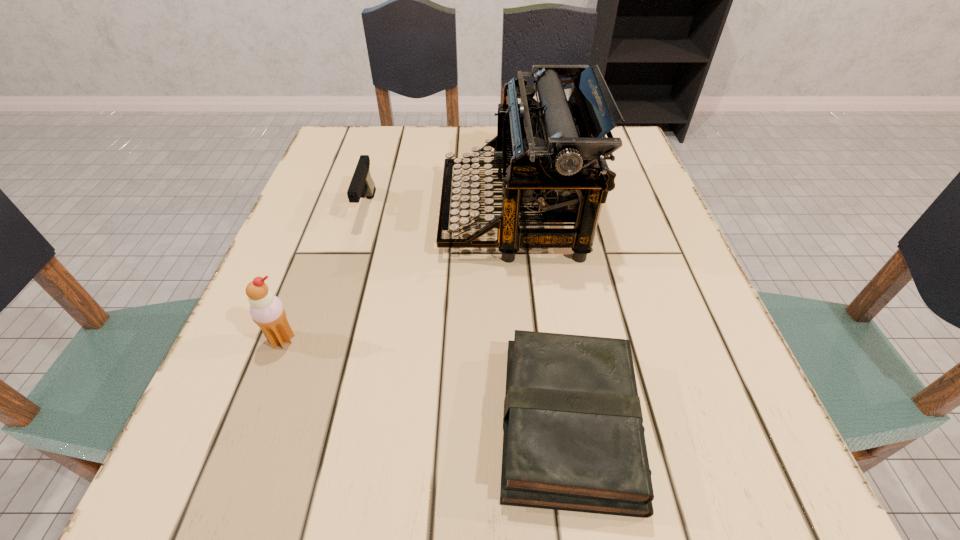
Locate an element on the screen. The width and height of the screenshot is (960, 540). the tallest object is located at coordinates (551, 152).

Find the location of a particular element. Image resolution: width=960 pixels, height=540 pixels. the second tallest object is located at coordinates (267, 311).

Locate an element on the screen. the leftmost object is located at coordinates (267, 311).

Where is `the third tallest object`? the third tallest object is located at coordinates (362, 184).

Locate an element on the screen. the second object from left to right is located at coordinates (362, 184).

Identify the location of the shortest object. (573, 440).

At what (x,y) coordinates should I click in order to perform the action: click on free space located 0.070m on the typing side of the typewriter. Please return your answer as a coordinate pair (x, y). The image size is (960, 540). Looking at the image, I should click on (409, 214).

Locate an element on the screen. vacant space situated 0.090m on the typing side of the typewriter is located at coordinates (399, 214).

You are a GUI agent. You are given a task and a screenshot of the screen. Output one action in this format:
    pyautogui.click(x=<x>, y=<y>)
    Task: Click on the free point located on the typing side of the typewriter
    The height and width of the screenshot is (540, 960).
    Given the screenshot: What is the action you would take?
    pyautogui.click(x=380, y=214)

Identify the location of vacant point located 0.060m at the front with a straw on the icecream. The height and width of the screenshot is (540, 960). (265, 386).